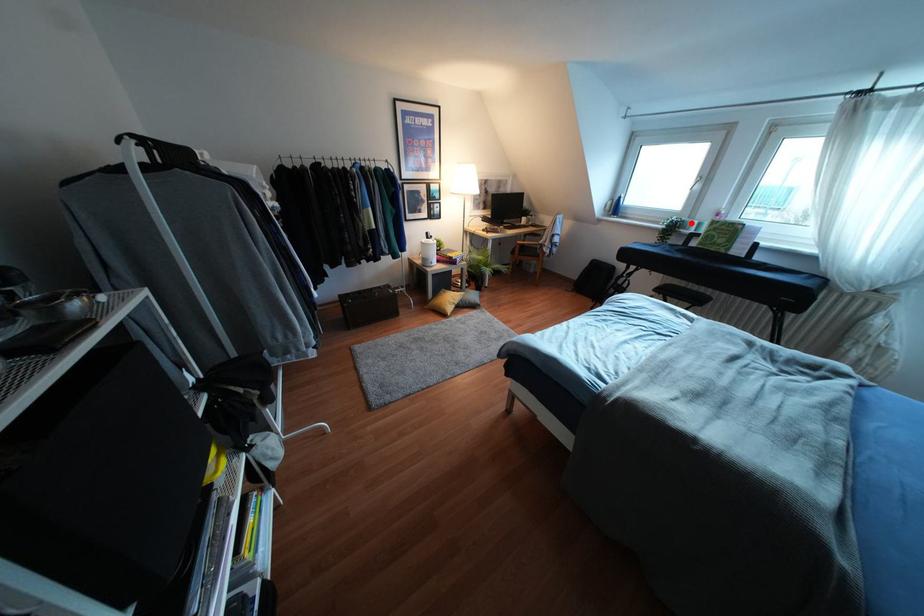
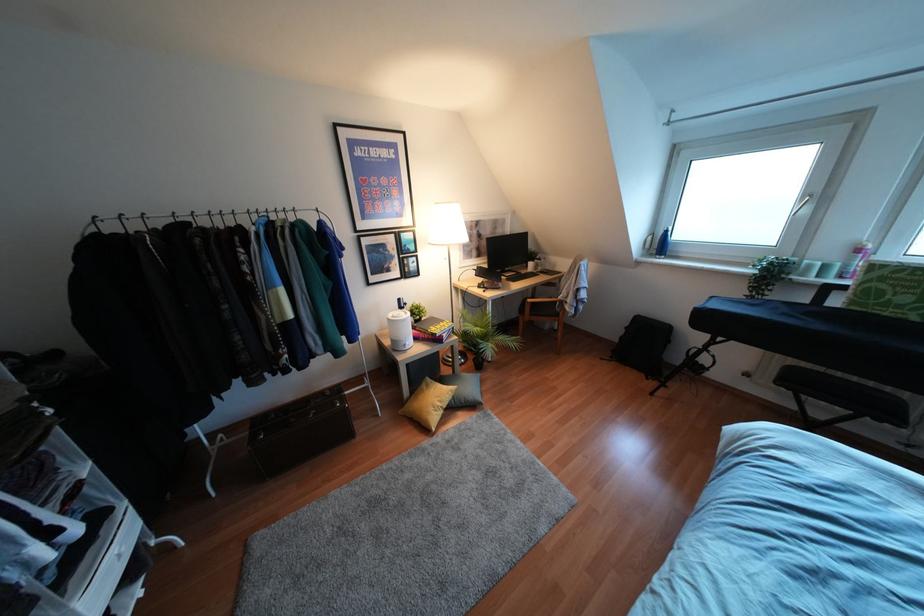
Locate, in the second image, the point that corresponds to the highlighted location in the first image.

(809, 265)